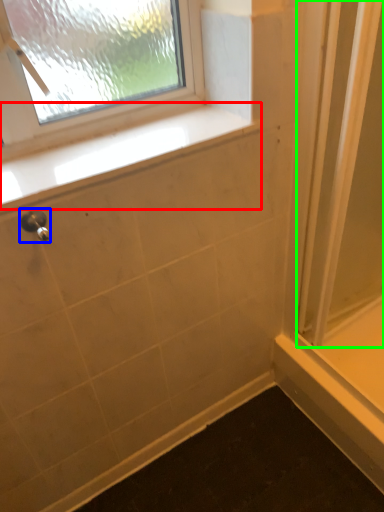
Question: Which object is positioned farthest from window sill (highlighted by a red box)? Select from shower (highlighted by a blue box) and screen door (highlighted by a green box).

Choices:
 (A) shower
 (B) screen door

Answer: (B)